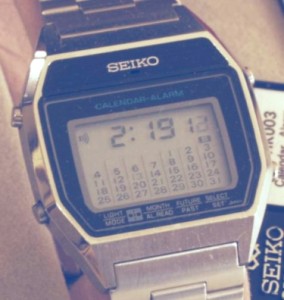
Locate an element on the screen. This screenshot has height=300, width=284. table is located at coordinates (23, 53), (262, 59).